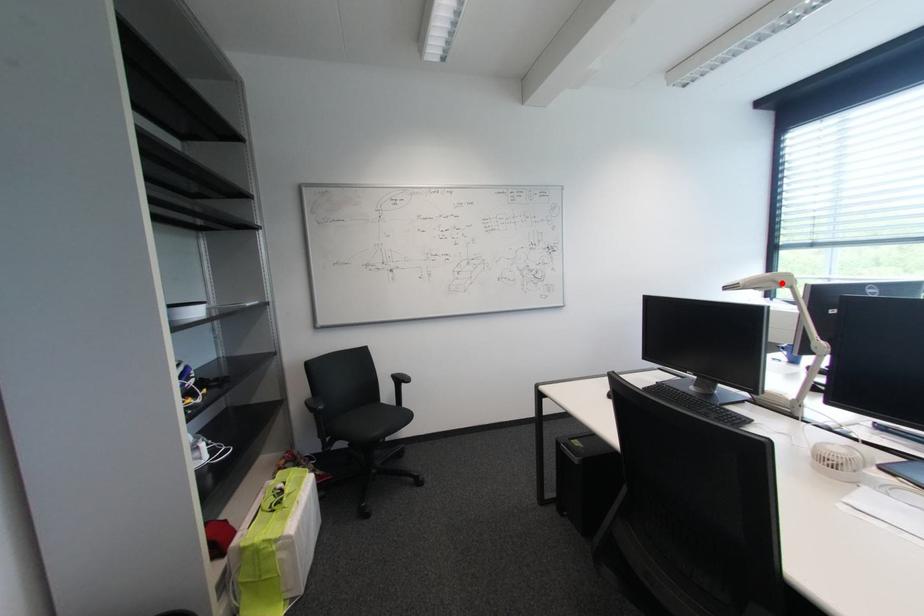
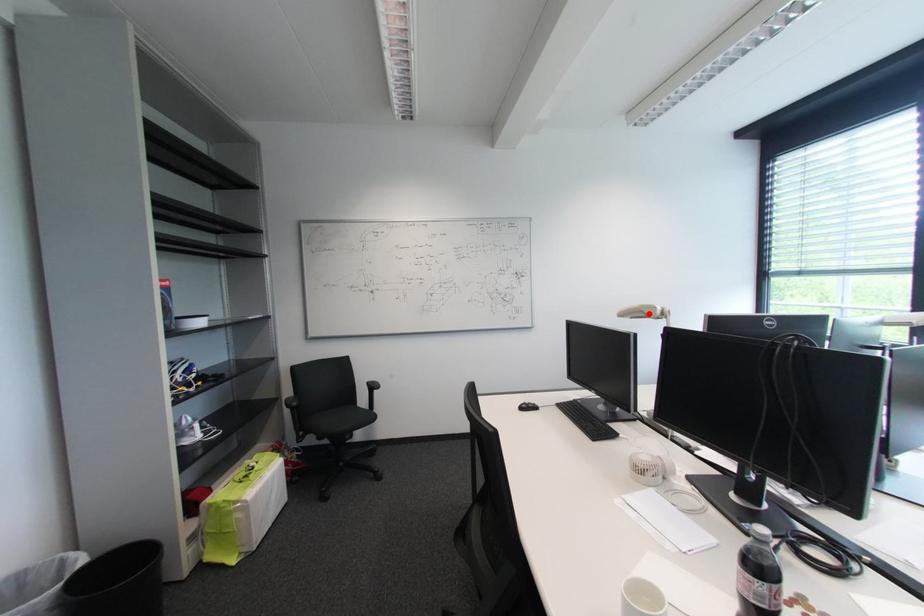
I am providing you with two images of the same scene from different viewpoints. A red point is marked on the first image and another point is marked on the second image. Do the highlighted points in image1 and image2 indicate the same real-world spot?

Yes